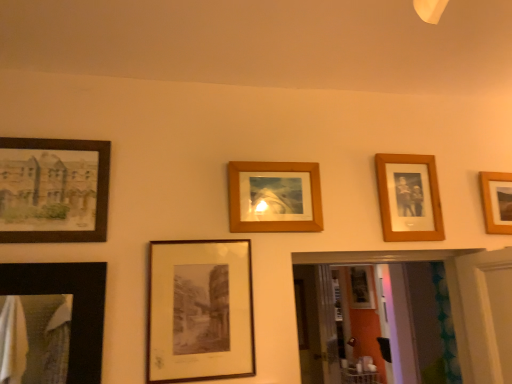
The height and width of the screenshot is (384, 512). What do you see at coordinates (497, 201) in the screenshot? I see `wooden frame at upper right, the 5th picture frame positioned from the left` at bounding box center [497, 201].

In order to face wooden frame at center, which is the 3th picture frame from left to right, should I rotate leftwards or rightwards?

You should rotate right by 2.513 degrees.

Locate an element on the screen. matte black painting at left, the first picture frame viewed from the left is located at coordinates (53, 190).

Is wooden frame at center, which is the 3th picture frame from left to right, oriented towards matte black painting at left, the first picture frame viewed from the left?

No, wooden frame at center, which is the 3th picture frame from left to right, is not aimed at matte black painting at left, the first picture frame viewed from the left.

Who is smaller, wooden frame at center, which is the 3th picture frame from left to right, or matte black painting at left, placed as the fifth picture frame when sorted from right to left?

Smaller between the two is wooden frame at center, which is the 3th picture frame from left to right.

From the image's perspective, which object appears higher, wooden frame at center, which appears as the third picture frame when viewed from the right, or matte black painting at left, the first picture frame viewed from the left?

matte black painting at left, the first picture frame viewed from the left.

Between wooden frame at center, which is the 3th picture frame from left to right, and matte black painting at left, the first picture frame viewed from the left, which one appears on the left side from the viewer's perspective?

From the viewer's perspective, matte black painting at left, the first picture frame viewed from the left, appears more on the left side.

Does wooden frame at upper right, the 5th picture frame positioned from the left, touch matte black painting at left, placed as the fifth picture frame when sorted from right to left?

No, wooden frame at upper right, the 5th picture frame positioned from the left, is not with matte black painting at left, placed as the fifth picture frame when sorted from right to left.

Can you confirm if wooden frame at upper right, the 5th picture frame positioned from the left, is positioned to the left of matte black painting at left, placed as the fifth picture frame when sorted from right to left?

No, wooden frame at upper right, the 5th picture frame positioned from the left, is not to the left of matte black painting at left, placed as the fifth picture frame when sorted from right to left.

From the image's perspective, is wooden frame at upper right, acting as the first picture frame starting from the right, beneath matte black painting at left, placed as the fifth picture frame when sorted from right to left?

Yes, from the image's perspective, wooden frame at upper right, acting as the first picture frame starting from the right, is below matte black painting at left, placed as the fifth picture frame when sorted from right to left.

Is wooden frame at upper right, acting as the first picture frame starting from the right, situated inside matte black painting at left, the first picture frame viewed from the left, or outside?

The correct answer is: outside.

Is wooden frame at upper right, acting as the first picture frame starting from the right, located outside matte black frame at center, acting as the 2th picture frame starting from the left?

Yes, wooden frame at upper right, acting as the first picture frame starting from the right, is located beyond the bounds of matte black frame at center, acting as the 2th picture frame starting from the left.

Is wooden frame at upper right, acting as the first picture frame starting from the right, in contact with matte black frame at center, marked as the 4th picture frame in a right-to-left arrangement?

No, wooden frame at upper right, acting as the first picture frame starting from the right, is not next to matte black frame at center, marked as the 4th picture frame in a right-to-left arrangement.

Based on the photo, can you confirm if wooden frame at upper right, acting as the first picture frame starting from the right, is taller than matte black frame at center, acting as the 2th picture frame starting from the left?

No.

Looking at the image, does matte black frame at center, marked as the 4th picture frame in a right-to-left arrangement, seem bigger or smaller compared to matte black painting at left, placed as the fifth picture frame when sorted from right to left?

matte black frame at center, marked as the 4th picture frame in a right-to-left arrangement, is smaller than matte black painting at left, placed as the fifth picture frame when sorted from right to left.

Can you confirm if matte black frame at center, marked as the 4th picture frame in a right-to-left arrangement, is thinner than matte black painting at left, placed as the fifth picture frame when sorted from right to left?

Correct, the width of matte black frame at center, marked as the 4th picture frame in a right-to-left arrangement, is less than that of matte black painting at left, placed as the fifth picture frame when sorted from right to left.

Considering the positions of objects matte black frame at center, acting as the 2th picture frame starting from the left, and matte black painting at left, the first picture frame viewed from the left, in the image provided, who is more to the left, matte black frame at center, acting as the 2th picture frame starting from the left, or matte black painting at left, the first picture frame viewed from the left,?

matte black painting at left, the first picture frame viewed from the left.

Is matte black frame at center, acting as the 2th picture frame starting from the left, oriented towards matte black painting at left, the first picture frame viewed from the left?

No.

What's the angular difference between wooden frame at upper right, the 5th picture frame positioned from the left, and wooden photo frame at upper right, the 2th picture frame from the right,'s facing directions?

They differ by 1.33 degrees in their facing directions.

From a real-world perspective, who is located higher, wooden frame at upper right, acting as the first picture frame starting from the right, or wooden photo frame at upper right, the fourth picture frame positioned from the left?

wooden photo frame at upper right, the fourth picture frame positioned from the left, from a real-world perspective.

Is wooden frame at upper right, the 5th picture frame positioned from the left, positioned before wooden photo frame at upper right, the 2th picture frame from the right?

That is False.

Which object is positioned more to the right, wooden frame at upper right, the 5th picture frame positioned from the left, or wooden photo frame at upper right, the 2th picture frame from the right?

Positioned to the right is wooden frame at upper right, the 5th picture frame positioned from the left.

Is wooden photo frame at upper right, the 2th picture frame from the right, to the left of wooden frame at center, which appears as the third picture frame when viewed from the right, from the viewer's perspective?

Incorrect, wooden photo frame at upper right, the 2th picture frame from the right, is not on the left side of wooden frame at center, which appears as the third picture frame when viewed from the right.

Between wooden photo frame at upper right, the fourth picture frame positioned from the left, and wooden frame at center, which is the 3th picture frame from left to right, which one has smaller width?

wooden frame at center, which is the 3th picture frame from left to right, is thinner.

Where is `picture frame that is the 1st object above the wooden frame at center, which appears as the third picture frame when viewed from the right (from a real-world perspective)`? Image resolution: width=512 pixels, height=384 pixels. picture frame that is the 1st object above the wooden frame at center, which appears as the third picture frame when viewed from the right (from a real-world perspective) is located at coordinates (409, 197).

Does wooden photo frame at upper right, the fourth picture frame positioned from the left, come in front of wooden frame at center, which is the 3th picture frame from left to right?

No, it is behind wooden frame at center, which is the 3th picture frame from left to right.

Considering their positions, is wooden frame at center, which appears as the third picture frame when viewed from the right, located in front of or behind matte black frame at center, marked as the 4th picture frame in a right-to-left arrangement?

In the image, wooden frame at center, which appears as the third picture frame when viewed from the right, appears behind matte black frame at center, marked as the 4th picture frame in a right-to-left arrangement.

From the image's perspective, which one is positioned higher, wooden frame at center, which is the 3th picture frame from left to right, or matte black frame at center, marked as the 4th picture frame in a right-to-left arrangement?

wooden frame at center, which is the 3th picture frame from left to right, appears higher in the image.

Is wooden frame at center, which is the 3th picture frame from left to right, inside the boundaries of matte black frame at center, acting as the 2th picture frame starting from the left, or outside?

wooden frame at center, which is the 3th picture frame from left to right, is spatially situated outside matte black frame at center, acting as the 2th picture frame starting from the left.

There is a matte black painting at left, placed as the fifth picture frame when sorted from right to left. Where is `the 1st picture frame below it (from the image's perspective)`? The width and height of the screenshot is (512, 384). the 1st picture frame below it (from the image's perspective) is located at coordinates (274, 197).

Which picture frame is the 4th one when counting from the right side of the matte black painting at left, the first picture frame viewed from the left? Please provide its 2D coordinates.

[(497, 201)]

Estimate the real-world distances between objects in this image. Which object is closer to wooden photo frame at upper right, the fourth picture frame positioned from the left, wooden frame at upper right, acting as the first picture frame starting from the right, or matte black frame at center, marked as the 4th picture frame in a right-to-left arrangement?

wooden frame at upper right, acting as the first picture frame starting from the right.

From the image, which object appears to be farther from matte black painting at left, placed as the fifth picture frame when sorted from right to left, wooden frame at center, which is the 3th picture frame from left to right, or matte black frame at center, marked as the 4th picture frame in a right-to-left arrangement?

wooden frame at center, which is the 3th picture frame from left to right, is further to matte black painting at left, placed as the fifth picture frame when sorted from right to left.

Considering their positions, is wooden photo frame at upper right, the fourth picture frame positioned from the left, positioned further to wooden frame at center, which is the 3th picture frame from left to right, than matte black painting at left, placed as the fifth picture frame when sorted from right to left?

matte black painting at left, placed as the fifth picture frame when sorted from right to left, is positioned further to the anchor wooden frame at center, which is the 3th picture frame from left to right.

Based on their spatial positions, is matte black painting at left, placed as the fifth picture frame when sorted from right to left, or wooden photo frame at upper right, the 2th picture frame from the right, further from matte black frame at center, marked as the 4th picture frame in a right-to-left arrangement?

wooden photo frame at upper right, the 2th picture frame from the right, is positioned further to the anchor matte black frame at center, marked as the 4th picture frame in a right-to-left arrangement.

When comparing their distances from matte black painting at left, placed as the fifth picture frame when sorted from right to left, does matte black frame at center, acting as the 2th picture frame starting from the left, or wooden frame at upper right, the 5th picture frame positioned from the left, seem further?

wooden frame at upper right, the 5th picture frame positioned from the left, lies further to matte black painting at left, placed as the fifth picture frame when sorted from right to left, than the other object.

Estimate the real-world distances between objects in this image. Which object is further from wooden photo frame at upper right, the fourth picture frame positioned from the left, matte black frame at center, marked as the 4th picture frame in a right-to-left arrangement, or matte black painting at left, placed as the fifth picture frame when sorted from right to left?

matte black painting at left, placed as the fifth picture frame when sorted from right to left, lies further to wooden photo frame at upper right, the fourth picture frame positioned from the left, than the other object.

From the image, which object appears to be nearer to matte black painting at left, the first picture frame viewed from the left, wooden photo frame at upper right, the fourth picture frame positioned from the left, or matte black frame at center, acting as the 2th picture frame starting from the left?

The object closer to matte black painting at left, the first picture frame viewed from the left, is matte black frame at center, acting as the 2th picture frame starting from the left.

From the picture: From the image, which object appears to be nearer to wooden frame at upper right, acting as the first picture frame starting from the right, matte black painting at left, the first picture frame viewed from the left, or wooden photo frame at upper right, the 2th picture frame from the right?

wooden photo frame at upper right, the 2th picture frame from the right, is positioned closer to the anchor wooden frame at upper right, acting as the first picture frame starting from the right.

At what (x,y) coordinates should I click in order to perform the action: click on picture frame situated between matte black frame at center, marked as the 4th picture frame in a right-to-left arrangement, and wooden photo frame at upper right, the 2th picture frame from the right, from left to right. Please return your answer as a coordinate pair (x, y). This screenshot has height=384, width=512. Looking at the image, I should click on (274, 197).

This screenshot has height=384, width=512. What are the coordinates of `picture frame between wooden frame at center, which is the 3th picture frame from left to right, and wooden frame at upper right, acting as the first picture frame starting from the right, in the horizontal direction` in the screenshot? It's located at tap(409, 197).

Find the location of a particular element. Image resolution: width=512 pixels, height=384 pixels. picture frame between matte black painting at left, placed as the fifth picture frame when sorted from right to left, and wooden frame at center, which appears as the third picture frame when viewed from the right, in the horizontal direction is located at coordinates 200,311.